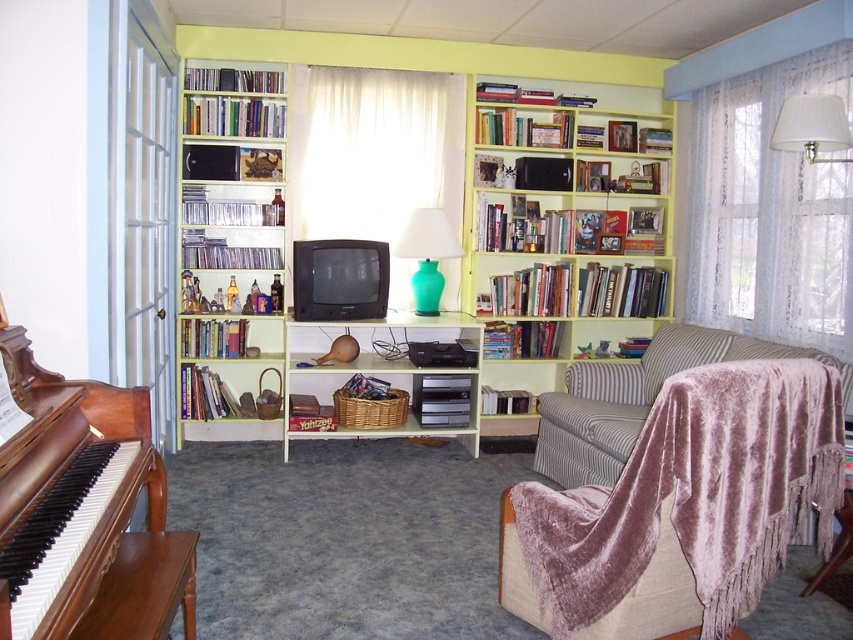
Question: Which point is farther from the camera taking this photo?

Choices:
 (A) (831, 180)
 (B) (416, 221)

Answer: (B)

Question: Does wooden bookshelf at center lie behind teal glass lamp at center?

Choices:
 (A) yes
 (B) no

Answer: (A)

Question: Which point appears closest to the camera in this image?

Choices:
 (A) (815, 108)
 (B) (448, 227)
 (C) (787, 385)
 (D) (105, 518)

Answer: (D)

Question: Which of the following is the farthest from the observer?

Choices:
 (A) white fabric lampshade at upper right
 (B) striped fabric armchair at right
 (C) wooden bookshelf at center
 (D) white lace curtain at right

Answer: (C)

Question: Is wooden bookshelf at center thinner than white sheer curtain at center?

Choices:
 (A) no
 (B) yes

Answer: (A)

Question: Does wooden piano at left appear on the right side of teal glass lamp at center?

Choices:
 (A) yes
 (B) no

Answer: (B)